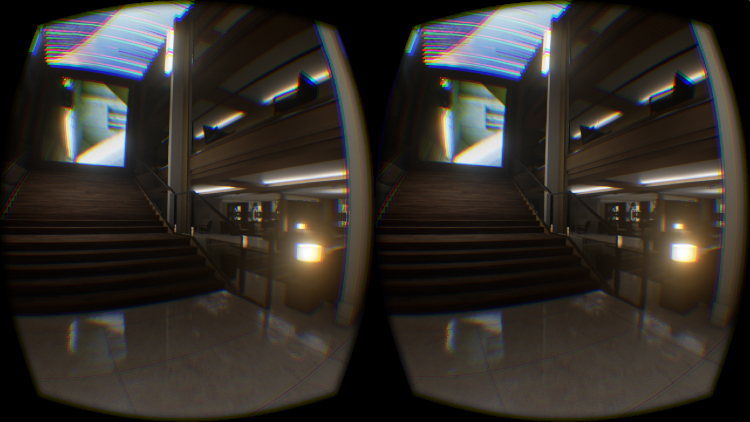
This screenshot has width=750, height=422. In order to click on white pillar in this screenshot , I will do `click(543, 140)`.